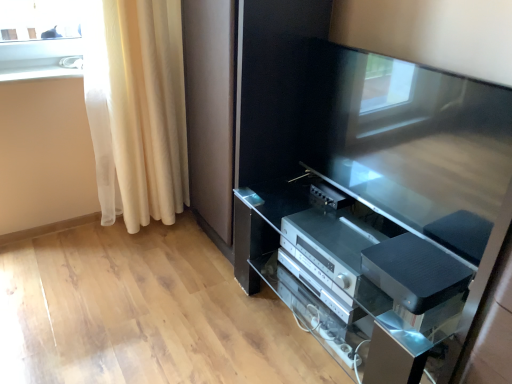
Locate an element on the screen. The width and height of the screenshot is (512, 384). free spot above black textured speaker at lower right, the 1th appliance when ordered from front to back (from a real-world perspective) is located at coordinates (417, 261).